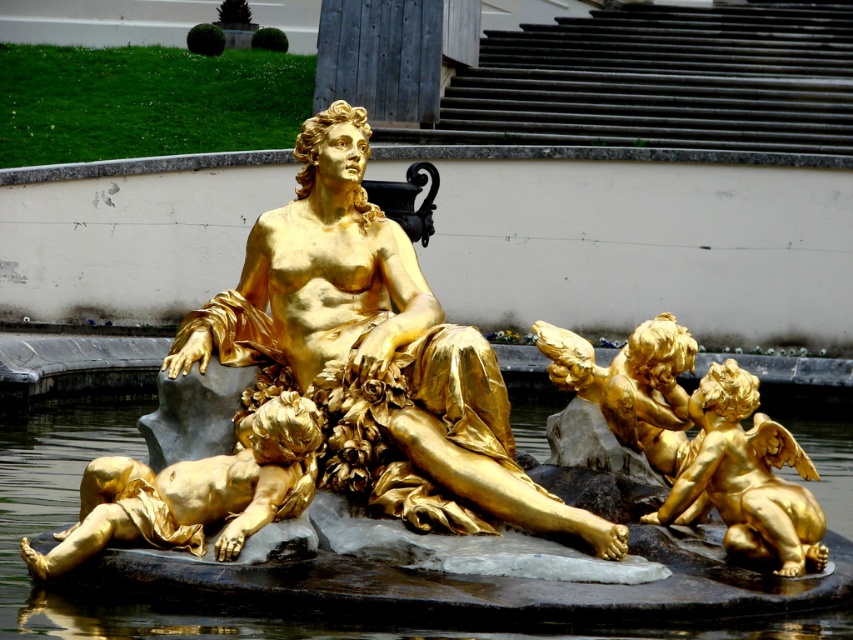
Can you confirm if gold polished cherub at lower left is thinner than golden polished cherub at right?

No, gold polished cherub at lower left is not thinner than golden polished cherub at right.

Which is behind, point (271, 408) or point (734, 410)?

The point (734, 410) is more distant.

At what (x,y) coordinates should I click in order to perform the action: click on gold polished cherub at lower left. Please return your answer as a coordinate pair (x, y). The height and width of the screenshot is (640, 853). Looking at the image, I should click on (195, 492).

Who is shorter, gold polished statue at center or shiny metallic water at center?

shiny metallic water at center

Is gold polished statue at center positioned at the back of shiny metallic water at center?

Yes, gold polished statue at center is further from the viewer.

Identify the location of gold polished statue at center. (374, 355).

Where is `gold polished statue at center`? gold polished statue at center is located at coordinates [374, 355].

Does gold polished statue at center have a larger size compared to gold polished cherub at lower left?

Correct, gold polished statue at center is larger in size than gold polished cherub at lower left.

Can you confirm if gold polished statue at center is positioned below gold polished cherub at lower left?

Incorrect, gold polished statue at center is not positioned below gold polished cherub at lower left.

Does point (335, 316) come behind point (149, 531)?

Yes.

What are the coordinates of `gold polished statue at center` in the screenshot? It's located at (374, 355).